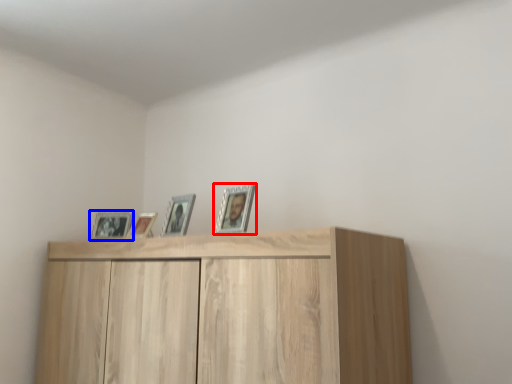
Question: Which object is closer to the camera taking this photo, picture frame (highlighted by a red box) or picture frame (highlighted by a blue box)?

Choices:
 (A) picture frame
 (B) picture frame

Answer: (A)